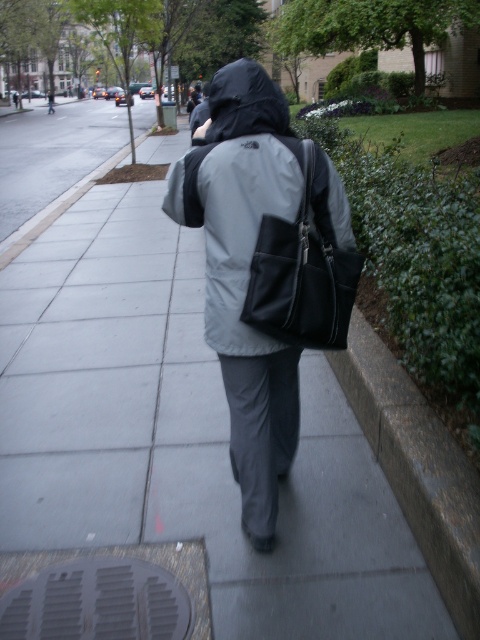
Question: Which point appears closest to the camera in this image?

Choices:
 (A) (188, 618)
 (B) (262, 312)
 (C) (252, 202)
 (D) (219, 122)

Answer: (B)

Question: Is gray metallic manhole cover at lower left to the left of black matte hood at center from the viewer's perspective?

Choices:
 (A) yes
 (B) no

Answer: (A)

Question: Estimate the real-world distances between objects in this image. Which object is closer to the black leather backpack at center?

Choices:
 (A) black matte hood at center
 (B) gray metallic manhole cover at lower left
 (C) gray matte jacket at center

Answer: (C)

Question: Does gray metallic manhole cover at lower left have a larger size compared to black matte hood at center?

Choices:
 (A) yes
 (B) no

Answer: (B)

Question: Which point appears farthest from the camera in this image?

Choices:
 (A) (242, 307)
 (B) (211, 273)
 (C) (280, 120)
 (D) (132, 564)

Answer: (D)

Question: Considering the relative positions of gray matte jacket at center and gray metallic manhole cover at lower left in the image provided, where is gray matte jacket at center located with respect to gray metallic manhole cover at lower left?

Choices:
 (A) above
 (B) below

Answer: (A)